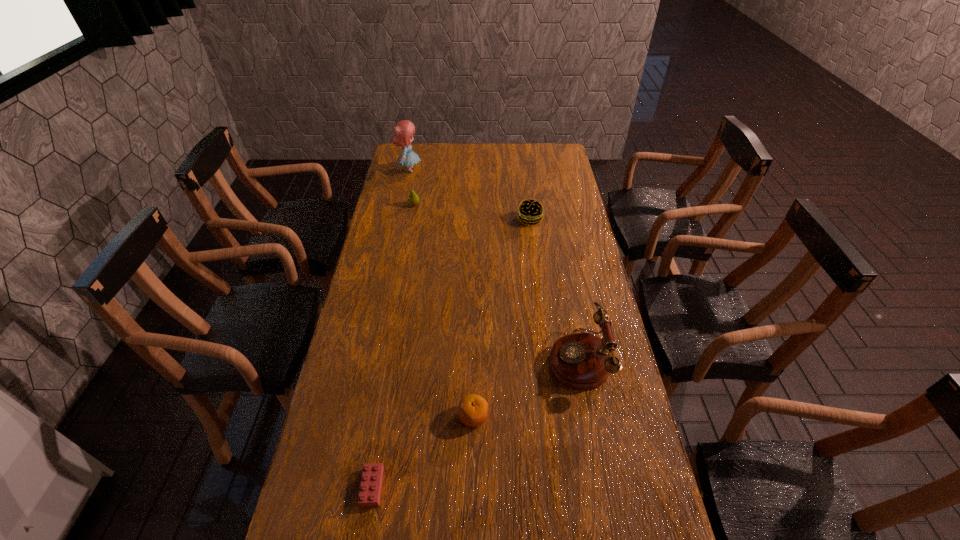
Locate an element on the screen. This screenshot has height=540, width=960. pear that is at the left edge is located at coordinates (413, 199).

Where is `Lego at the left edge`? Image resolution: width=960 pixels, height=540 pixels. Lego at the left edge is located at coordinates (371, 482).

At what (x,y) coordinates should I click in order to perform the action: click on telephone that is at the right edge. Please return your answer as a coordinate pair (x, y). Looking at the image, I should click on (580, 360).

Image resolution: width=960 pixels, height=540 pixels. Find the location of `patty located at the right edge`. patty located at the right edge is located at coordinates (531, 212).

Image resolution: width=960 pixels, height=540 pixels. Identify the location of object at the far left corner. (403, 131).

You are a GUI agent. You are given a task and a screenshot of the screen. Output one action in this format:
    pyautogui.click(x=<x>, y=<y>)
    Task: Click on the vacant space at the far edge of the desktop
    
    Given the screenshot: What is the action you would take?
    pyautogui.click(x=494, y=146)

The image size is (960, 540). In order to click on vacant space at the left edge of the desktop in this screenshot , I will do `click(377, 340)`.

What are the coordinates of `free location at the right edge of the desktop` in the screenshot? It's located at (562, 175).

Locate an element on the screen. The image size is (960, 540). unoccupied area between the second shortest object and the farthest object is located at coordinates (442, 293).

Find the location of a particular element. The height and width of the screenshot is (540, 960). vacant area that lies between the telephone and the pear is located at coordinates (496, 281).